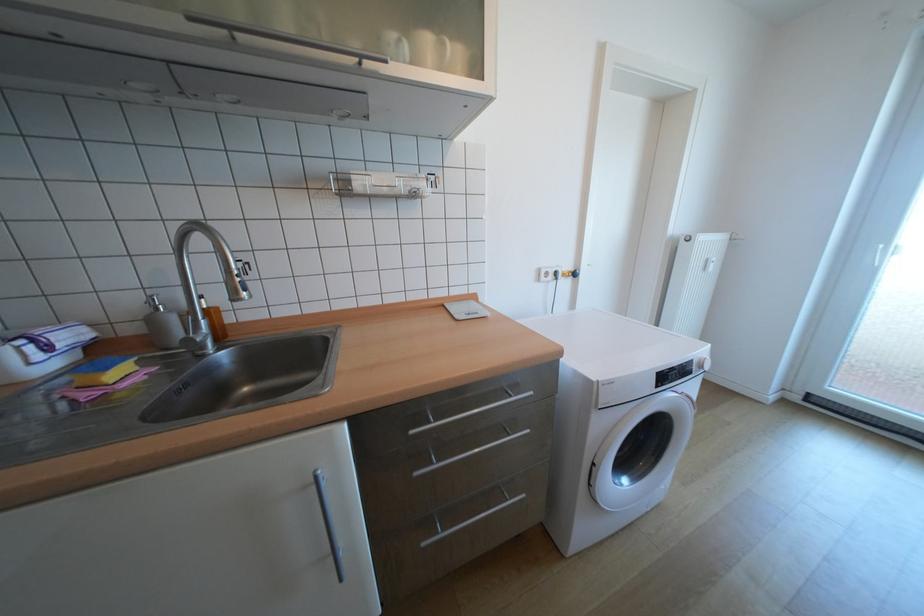
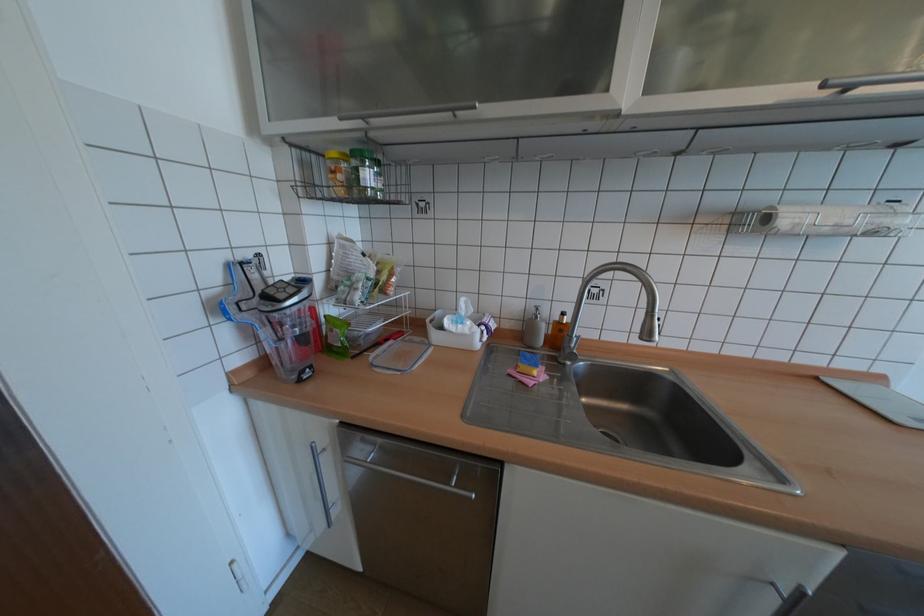
Where in the second image is the point corresponding to the point at 84,386 from the first image?

(527, 371)